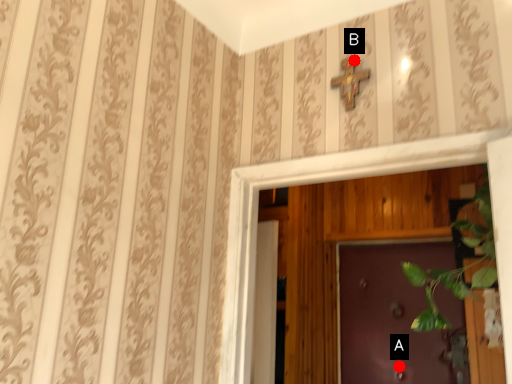
Question: Two points are circled on the image, labeled by A and B beside each circle. Which point appears farthest from the camera in this image?

Choices:
 (A) A is further
 (B) B is further

Answer: (A)